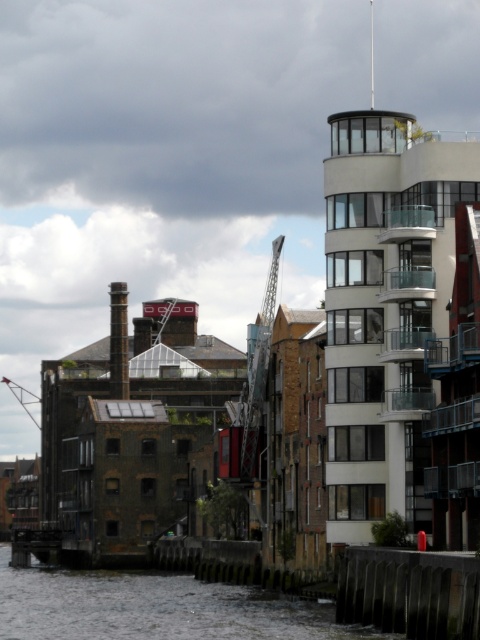
Question: From the image, what is the correct spatial relationship of gray concrete river at lower left in relation to metallic gray crane at left?

Choices:
 (A) below
 (B) above

Answer: (A)

Question: Which point appears closest to the camera in this image?

Choices:
 (A) (35, 420)
 (B) (252, 593)

Answer: (B)

Question: Is gray concrete river at lower left to the right of metallic gray crane at left from the viewer's perspective?

Choices:
 (A) yes
 (B) no

Answer: (A)

Question: From the image, what is the correct spatial relationship of gray concrete river at lower left in relation to metallic gray crane at left?

Choices:
 (A) left
 (B) right

Answer: (B)

Question: Among these objects, which one is farthest from the camera?

Choices:
 (A) gray concrete river at lower left
 (B) metallic gray crane at left

Answer: (B)